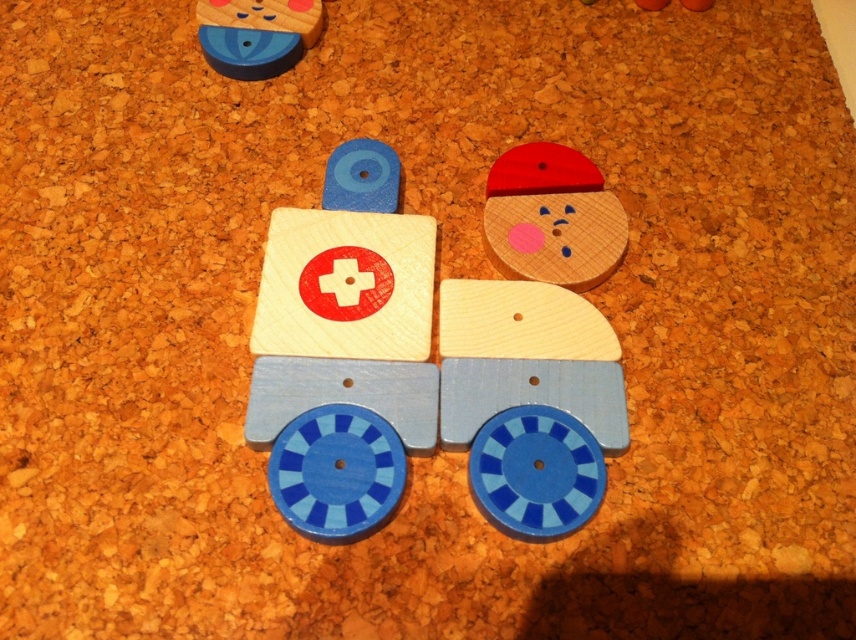
Which is more to the left, wooden ambulance at center or matte wood block at upper left?

Positioned to the left is matte wood block at upper left.

Is point (556, 365) farther from camera compared to point (221, 60)?

No.

You are a GUI agent. You are given a task and a screenshot of the screen. Output one action in this format:
    pyautogui.click(x=<x>, y=<y>)
    Task: Click on the wooden ambulance at center
    
    Given the screenshot: What is the action you would take?
    pyautogui.click(x=429, y=372)

Is wooden ambulance at center positioned at the back of wooden face at upper right?

No, it is not.

Which is more to the left, wooden ambulance at center or wooden face at upper right?

Positioned to the left is wooden ambulance at center.

Does point (334, 314) come farther from viewer compared to point (593, 182)?

That is False.

I want to click on wooden ambulance at center, so click(429, 372).

Can you confirm if wooden face at upper right is taller than matte wood block at upper left?

Indeed, wooden face at upper right has a greater height compared to matte wood block at upper left.

Locate an element on the screen. This screenshot has width=856, height=640. wooden face at upper right is located at coordinates (551, 218).